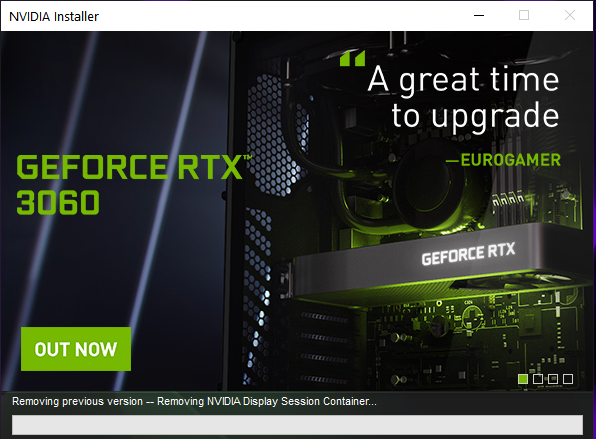
Find the location of a particular element. The height and width of the screenshot is (439, 596). empty boxes is located at coordinates (538, 376), (555, 378), (564, 379).